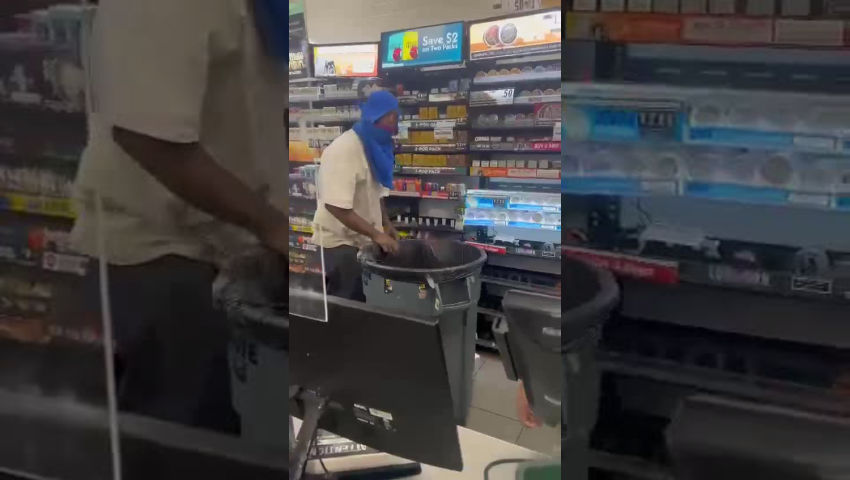
I want to click on store tiled floor, so click(x=490, y=395).